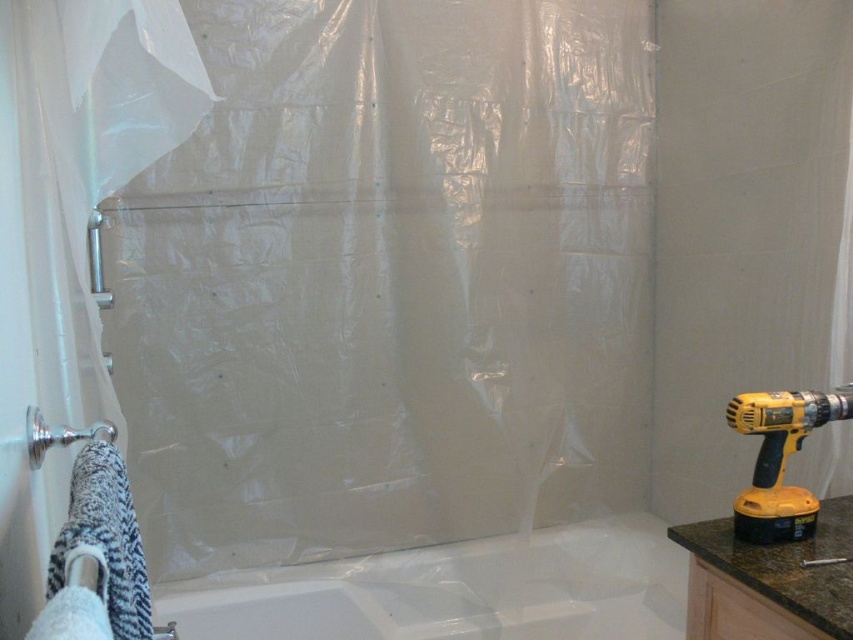
You are a contractor measuring the space between the transparent plastic shower curtain at upper center and the brushed metal towel bar at left. Which object has a greater width?

The transparent plastic shower curtain at upper center has a greater width than the brushed metal towel bar at left.

You are a contractor measuring the bathroom layout. The transparent plastic shower curtain at upper center is placed at coordinates. What are its coordinates?

The transparent plastic shower curtain at upper center is located at coordinates point (389, 280).